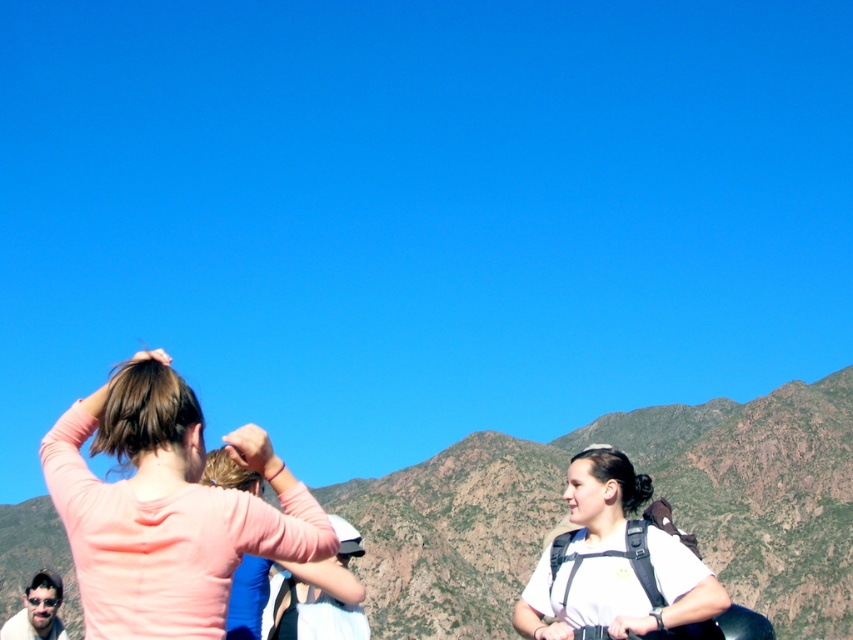
Question: Considering the relative positions of pink matte shirt at upper left and white matte backpack at center in the image provided, where is pink matte shirt at upper left located with respect to white matte backpack at center?

Choices:
 (A) left
 (B) right

Answer: (A)

Question: Which point is closer to the camera taking this photo?

Choices:
 (A) (845, 580)
 (B) (134, 356)
 (C) (621, 472)

Answer: (B)

Question: Is the position of green textured mountain at center more distant than that of white matte backpack at center?

Choices:
 (A) no
 (B) yes

Answer: (B)

Question: Is the position of green textured mountain at center more distant than that of white matte backpack at center?

Choices:
 (A) yes
 (B) no

Answer: (A)

Question: Which point appears farthest from the camera in this image?

Choices:
 (A) (x=795, y=554)
 (B) (x=119, y=589)
 (C) (x=672, y=579)

Answer: (A)

Question: Which of the following is the farthest from the observer?

Choices:
 (A) (213, 552)
 (B) (596, 493)

Answer: (B)